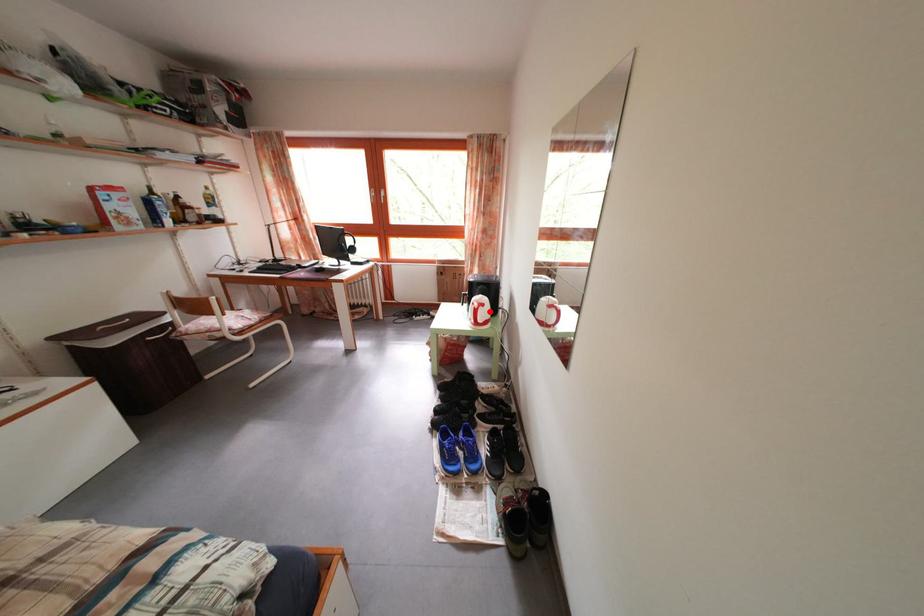
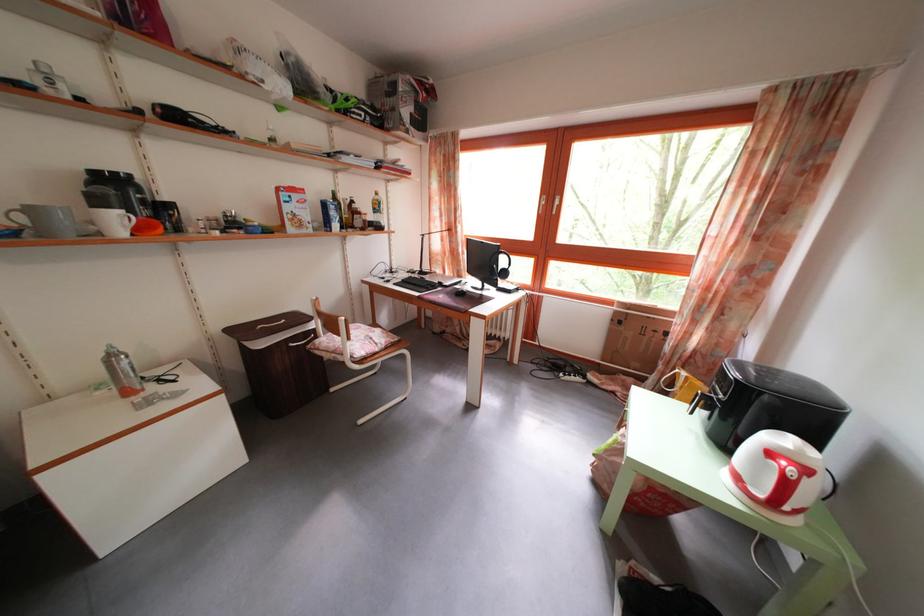
In the second image, find the point that corresponds to the highlighted location in the first image.

(812, 477)